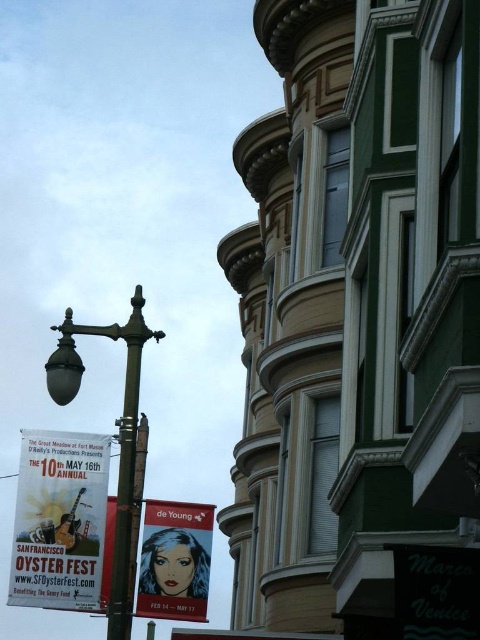
You are standing at the corner of the street and see the point marked at coordinates (118, 436). What object is located at that point?

The point at coordinates (118, 436) marks the location of the polished brass street light at center left.